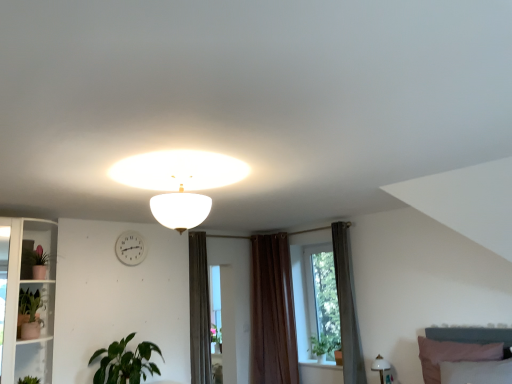
Question: From the image's perspective, is dark gray wooden bed at lower right located beneath green leafy plant at window, marked as the 1th plant in a back-to-front arrangement?

Choices:
 (A) no
 (B) yes

Answer: (A)

Question: Is dark gray wooden bed at lower right positioned with its back to green leafy plant at window, marked as the first plant in a right-to-left arrangement?

Choices:
 (A) no
 (B) yes

Answer: (A)

Question: Considering the relative sizes of dark gray wooden bed at lower right and green leafy plant at window, marked as the 1th plant in a back-to-front arrangement, in the image provided, is dark gray wooden bed at lower right taller than green leafy plant at window, marked as the 1th plant in a back-to-front arrangement,?

Choices:
 (A) yes
 (B) no

Answer: (A)

Question: Is dark gray wooden bed at lower right smaller than green leafy plant at window, marked as the 1th plant in a back-to-front arrangement?

Choices:
 (A) no
 (B) yes

Answer: (A)

Question: Is dark gray wooden bed at lower right not near green leafy plant at window, which is the second plant in front-to-back order?

Choices:
 (A) no
 (B) yes

Answer: (B)

Question: Considering the relative sizes of dark gray wooden bed at lower right and green leafy plant at window, which is counted as the 2th plant, starting from the left, in the image provided, is dark gray wooden bed at lower right wider than green leafy plant at window, which is counted as the 2th plant, starting from the left,?

Choices:
 (A) no
 (B) yes

Answer: (B)

Question: Is dark gray wooden bed at lower right wider than brown velvet curtain at center, positioned as the first curtain in left-to-right order?

Choices:
 (A) yes
 (B) no

Answer: (A)

Question: From a real-world perspective, does dark gray wooden bed at lower right sit lower than brown velvet curtain at center, the 2th curtain from the right?

Choices:
 (A) yes
 (B) no

Answer: (A)

Question: Is dark gray wooden bed at lower right positioned behind brown velvet curtain at center, the 1th curtain when ordered from back to front?

Choices:
 (A) yes
 (B) no

Answer: (B)

Question: Is brown velvet curtain at center, the 2th curtain from the right, completely or partially inside dark gray wooden bed at lower right?

Choices:
 (A) no
 (B) yes

Answer: (A)

Question: Is dark gray wooden bed at lower right positioned before brown velvet curtain at center, the 2th curtain from the right?

Choices:
 (A) no
 (B) yes

Answer: (B)

Question: Is dark gray wooden bed at lower right not close to brown velvet curtain at center, the 2th curtain from the right?

Choices:
 (A) no
 (B) yes

Answer: (B)

Question: Does brown fabric curtain at center, the first curtain from the front, appear on the right side of white glass shelf at left?

Choices:
 (A) no
 (B) yes

Answer: (B)